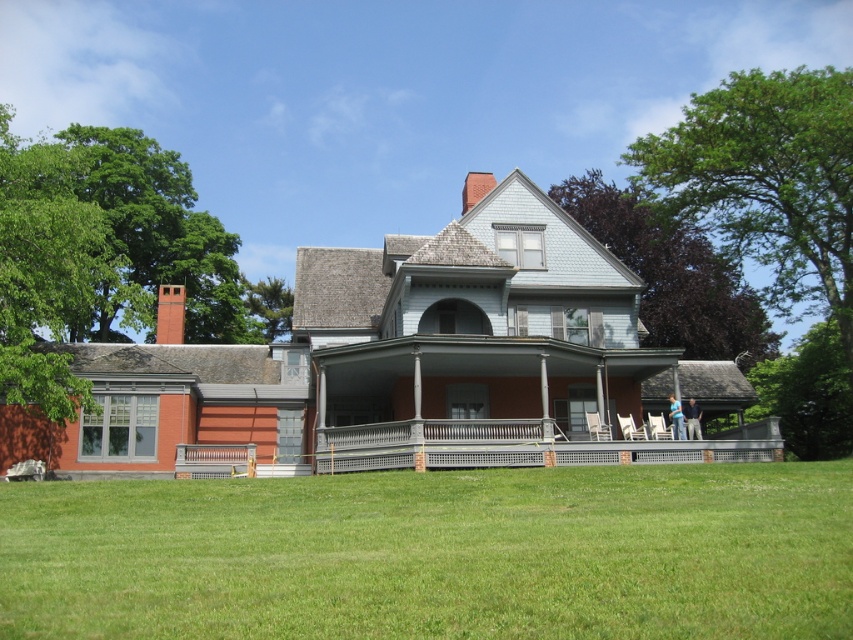
You are standing in front of the house and want to walk from the green grass at lower center to the gray wooden porch at center. Which direction should you move to reach the porch?

The gray wooden porch at center is above the green grass at lower center, so you should move upward to reach the porch.

You are standing at the front porch of the house and want to place a small garden bench. The bench is 1.2 meters wide. Can the green grass at lower center accommodate the bench without overlapping the blue fabric shirt at lower right?

The green grass at lower center might be wider than the blue fabric shirt at lower right, so there is a possibility that the bench can fit. However, since the exact width isn

You are standing in front of the house and see the gray wooden porch at center and the blue jeans at center. Which object is nearer to you?

The gray wooden porch at center is closer to the viewer than the blue jeans at center, so the gray wooden porch at center is nearer to you.